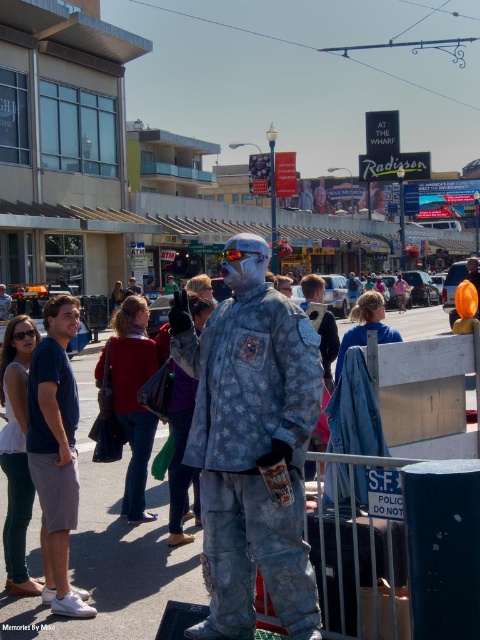
Question: From the image, what is the correct spatial relationship of metallic silver statue at center in relation to camouflage fabric mannequin at center?

Choices:
 (A) below
 (B) above

Answer: (B)

Question: Estimate the real-world distances between objects in this image. Which object is farther from the metallic silver statue at center?

Choices:
 (A) blue denim shorts at left
 (B) camouflage fabric mannequin at center

Answer: (B)

Question: Which point is farther to the camera?

Choices:
 (A) blue denim shorts at left
 (B) camouflage fabric mannequin at center
 (C) metallic silver statue at center

Answer: (C)

Question: Does camouflage fabric mannequin at center have a larger size compared to blue denim shorts at left?

Choices:
 (A) no
 (B) yes

Answer: (B)

Question: Which point appears farthest from the camera in this image?

Choices:
 (A) pyautogui.click(x=218, y=436)
 (B) pyautogui.click(x=73, y=422)

Answer: (B)

Question: Observing the image, what is the correct spatial positioning of metallic silver statue at center in reference to blue denim shorts at left?

Choices:
 (A) left
 (B) right

Answer: (B)